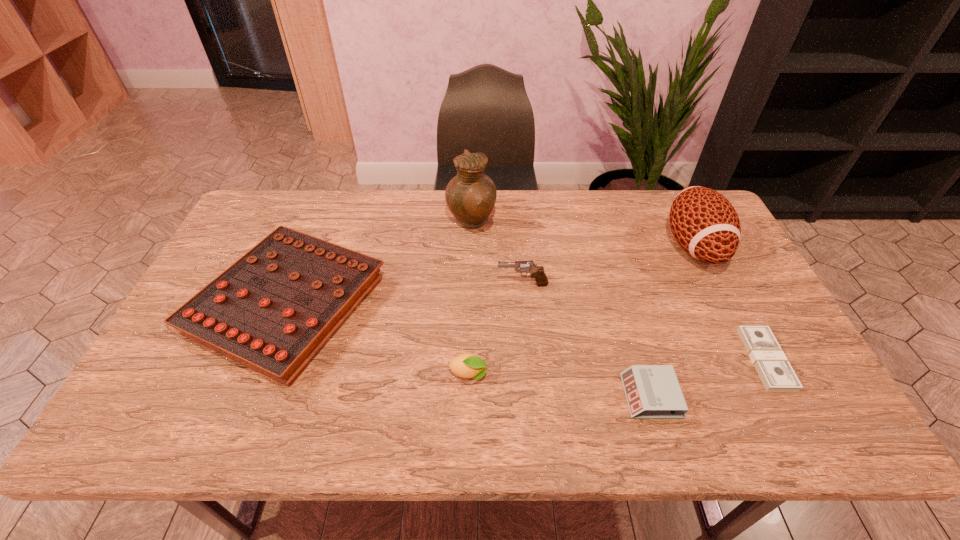
Find the location of `the tallest object`. the tallest object is located at coordinates (471, 195).

Where is `football`? Image resolution: width=960 pixels, height=540 pixels. football is located at coordinates (704, 223).

Find the location of a particular element. pistol is located at coordinates (537, 272).

Where is `gameboard`? The image size is (960, 540). gameboard is located at coordinates (272, 310).

Where is `the leftmost object`? The width and height of the screenshot is (960, 540). the leftmost object is located at coordinates (272, 310).

The width and height of the screenshot is (960, 540). Identify the location of the fifth tallest object. (467, 365).

You are a GUI agent. You are given a task and a screenshot of the screen. Output one action in this format:
    pyautogui.click(x=<x>, y=<y>)
    Task: Click on the alarm clock
    This screenshot has height=540, width=960.
    Given the screenshot: What is the action you would take?
    pyautogui.click(x=652, y=391)

This screenshot has width=960, height=540. In order to click on the second shortest object in this screenshot , I will do `click(652, 391)`.

This screenshot has height=540, width=960. Find the location of `dollar`. dollar is located at coordinates (777, 375).

Find the location of `vacant region located 0.270m at the spout of the pitcher`. vacant region located 0.270m at the spout of the pitcher is located at coordinates (577, 222).